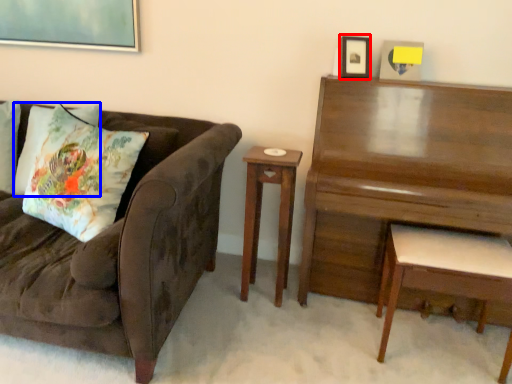
Question: Which of the following is the farthest to the observer, picture frame (highlighted by a red box) or pillow (highlighted by a blue box)?

Choices:
 (A) picture frame
 (B) pillow

Answer: (B)